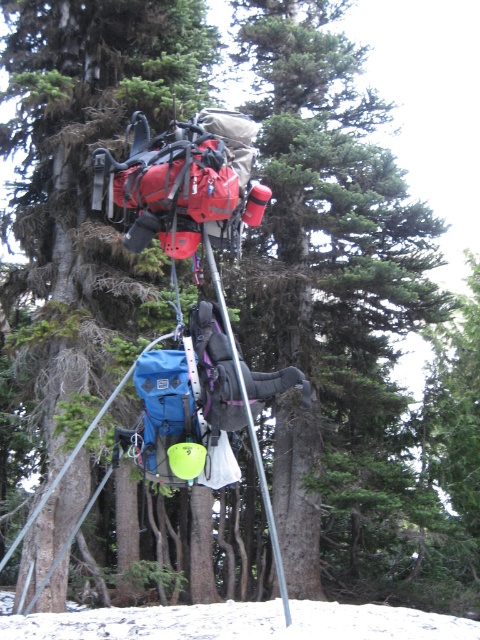
Question: Which of the following is the farthest from the observer?

Choices:
 (A) white powdery snow at lower center
 (B) green matte tree at center

Answer: (B)

Question: Based on their relative distances, which object is nearer to the white powdery snow at lower center?

Choices:
 (A) green matte backpack at center
 (B) green matte tree at center

Answer: (A)

Question: Which is farther from the white powdery snow at lower center?

Choices:
 (A) green matte tree at center
 (B) green matte backpack at center

Answer: (A)

Question: Can you confirm if green matte tree at center is positioned below white powdery snow at lower center?

Choices:
 (A) yes
 (B) no

Answer: (B)

Question: Is green matte backpack at center wider than white powdery snow at lower center?

Choices:
 (A) yes
 (B) no

Answer: (A)

Question: Does green matte backpack at center appear on the left side of white powdery snow at lower center?

Choices:
 (A) yes
 (B) no

Answer: (A)